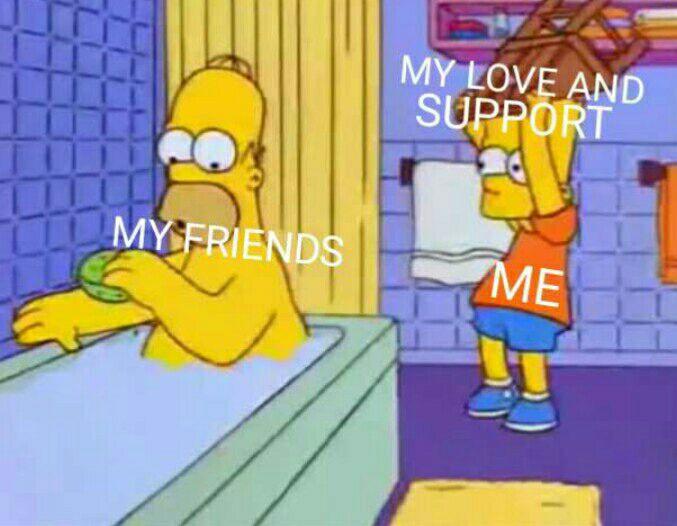
In order to click on tub in this screenshot , I will do `click(145, 432)`.